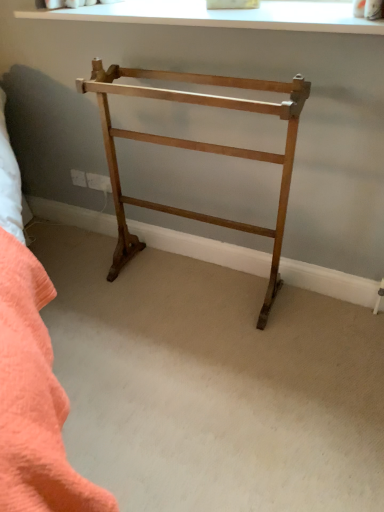
The image size is (384, 512). Describe the element at coordinates (223, 16) in the screenshot. I see `white smooth window at upper center` at that location.

Measure the distance between white smooth window at upper center and camera.

white smooth window at upper center is 4.02 feet away from camera.

Find the location of a particular element. white smooth window at upper center is located at coordinates tap(223, 16).

Describe the element at coordinates (197, 150) in the screenshot. I see `light brown wood towel rack at center` at that location.

At what (x,y) coordinates should I click in order to perform the action: click on light brown wood towel rack at center. Please return your answer as a coordinate pair (x, y). Looking at the image, I should click on (197, 150).

Identify the location of white smooth window at upper center. This screenshot has width=384, height=512. (223, 16).

Is light brown wood towel rack at center at the left side of white smooth window at upper center?

Correct, you'll find light brown wood towel rack at center to the left of white smooth window at upper center.

Is light brown wood towel rack at center closer to the viewer compared to white smooth window at upper center?

Yes, the depth of light brown wood towel rack at center is less than that of white smooth window at upper center.

Considering the points (223, 219) and (49, 13), which point is in front, point (223, 219) or point (49, 13)?

The point (49, 13) is more forward.

From the image's perspective, which one is positioned higher, light brown wood towel rack at center or white smooth window at upper center?

white smooth window at upper center.

From a real-world perspective, does light brown wood towel rack at center sit lower than white smooth window at upper center?

Yes.

Is light brown wood towel rack at center wider or thinner than white smooth window at upper center?

light brown wood towel rack at center is thinner than white smooth window at upper center.

Does light brown wood towel rack at center have a lesser height compared to white smooth window at upper center?

No.

Can you confirm if light brown wood towel rack at center is smaller than white smooth window at upper center?

Actually, light brown wood towel rack at center might be larger than white smooth window at upper center.

Is white smooth window at upper center located within light brown wood towel rack at center?

No.

Is light brown wood towel rack at center beside white smooth window at upper center?

light brown wood towel rack at center and white smooth window at upper center are not in contact.

Is light brown wood towel rack at center oriented away from white smooth window at upper center?

light brown wood towel rack at center is not turned away from white smooth window at upper center.

Can you tell me how much light brown wood towel rack at center and white smooth window at upper center differ in facing direction?

They differ by 0.000832 degrees in their facing directions.

The image size is (384, 512). Identify the location of window above the light brown wood towel rack at center (from the image's perspective). (223, 16).

Visually, is white smooth window at upper center positioned to the left or to the right of light brown wood towel rack at center?

From the image, it's evident that white smooth window at upper center is to the right of light brown wood towel rack at center.

Does white smooth window at upper center lie behind light brown wood towel rack at center?

Yes, it is behind light brown wood towel rack at center.

Which is behind, point (319, 30) or point (157, 208)?

The point (157, 208) is farther from the camera.

From the image's perspective, which is below, white smooth window at upper center or light brown wood towel rack at center?

light brown wood towel rack at center is shown below in the image.

From a real-world perspective, who is located lower, white smooth window at upper center or light brown wood towel rack at center?

In real-world perspective, light brown wood towel rack at center is lower.

Does white smooth window at upper center have a lesser width compared to light brown wood towel rack at center?

No.

Who is taller, white smooth window at upper center or light brown wood towel rack at center?

With more height is light brown wood towel rack at center.

In terms of size, does white smooth window at upper center appear bigger or smaller than light brown wood towel rack at center?

Considering their sizes, white smooth window at upper center takes up less space than light brown wood towel rack at center.

Would you say white smooth window at upper center is outside light brown wood towel rack at center?

Yes, white smooth window at upper center is located beyond the bounds of light brown wood towel rack at center.

Is white smooth window at upper center next to light brown wood towel rack at center?

No.

Is white smooth window at upper center aimed at light brown wood towel rack at center?

No, white smooth window at upper center is not aimed at light brown wood towel rack at center.

How much distance is there between white smooth window at upper center and light brown wood towel rack at center?

They are 15.65 inches apart.

This screenshot has width=384, height=512. Identify the location of furniture on the left of white smooth window at upper center. (197, 150).

This screenshot has height=512, width=384. I want to click on window on the right of light brown wood towel rack at center, so click(x=223, y=16).

In order to click on furniture lying on the left of white smooth window at upper center in this screenshot , I will do `click(197, 150)`.